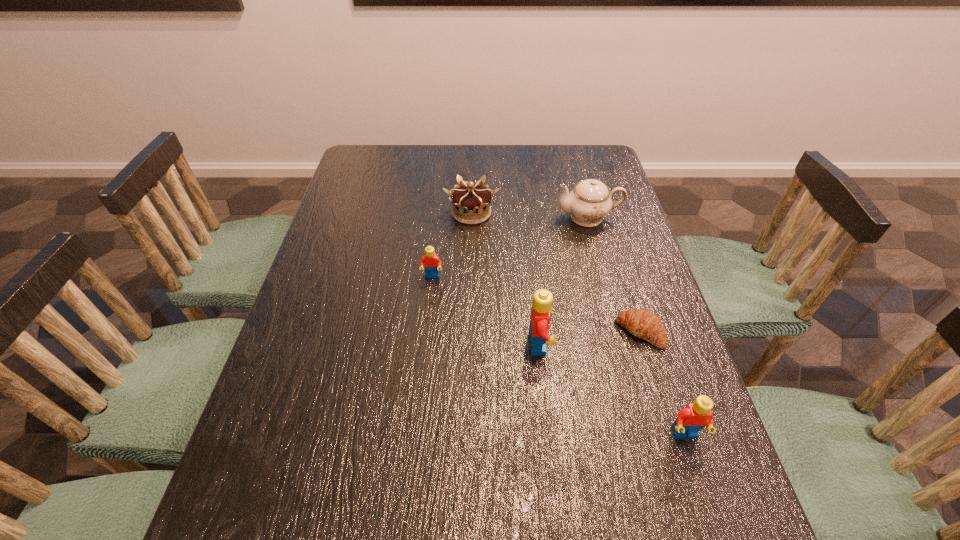
Identify the location of object located in the near right corner section of the desktop. (693, 417).

Where is `free spot at the far edge of the desktop`? This screenshot has height=540, width=960. free spot at the far edge of the desktop is located at coordinates (419, 155).

Where is `free space at the near edge of the desktop`? free space at the near edge of the desktop is located at coordinates (x=573, y=447).

The width and height of the screenshot is (960, 540). Identify the location of free location at the left edge of the desktop. (374, 252).

The width and height of the screenshot is (960, 540). I want to click on free space at the right edge of the desktop, so click(581, 235).

Locate an element on the screen. Image resolution: width=960 pixels, height=540 pixels. blank area at the far left corner is located at coordinates (380, 153).

This screenshot has width=960, height=540. I want to click on blank region between the second shortest Lego and the crown, so click(578, 323).

I want to click on vacant point located between the tallest object and the rightmost Lego, so click(612, 389).

This screenshot has height=540, width=960. Find the location of `vacant point located between the chinaware and the crown`. vacant point located between the chinaware and the crown is located at coordinates (530, 215).

Where is `empty space between the chinaware and the crown`? empty space between the chinaware and the crown is located at coordinates (530, 215).